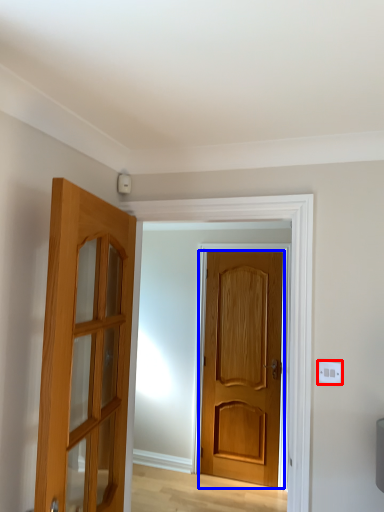
Question: Which point is closer to the camera, electric outlet (highlighted by a red box) or door (highlighted by a blue box)?

Choices:
 (A) electric outlet
 (B) door

Answer: (A)